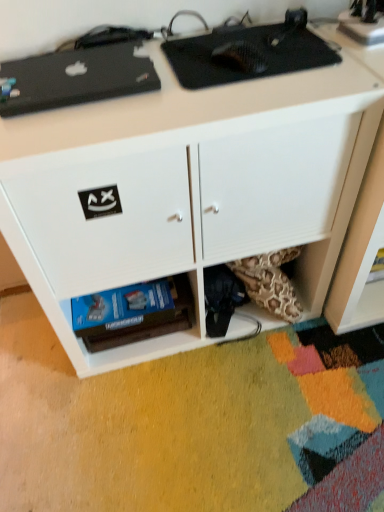
I want to click on empty space that is to the right of black matte laptop at upper left, positioned as the 1th appliance in left-to-right order, so click(x=190, y=88).